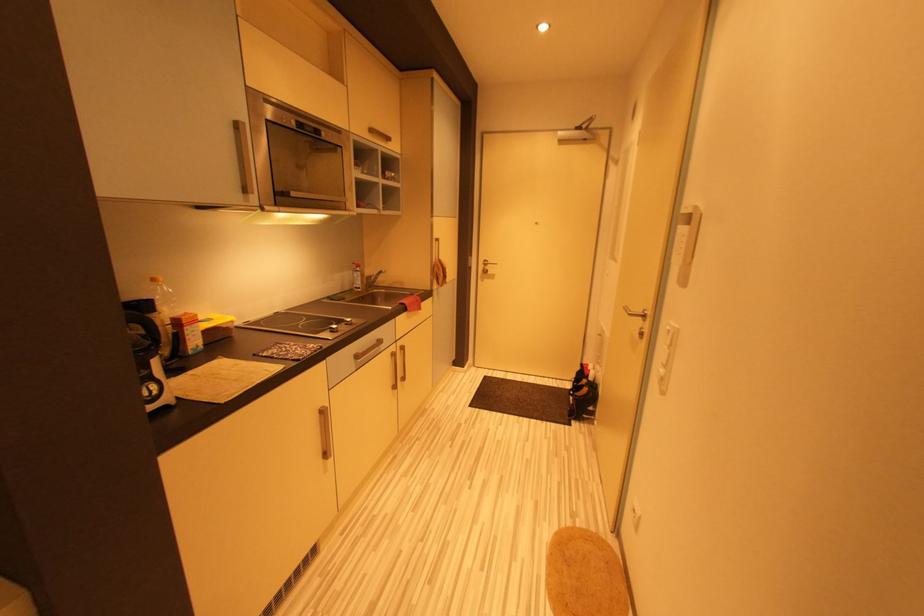
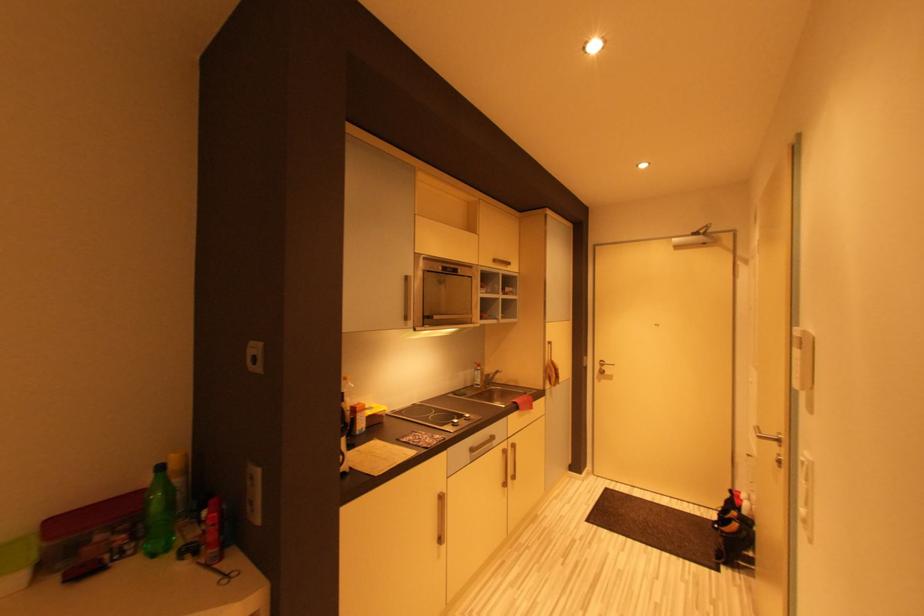
What movement of the cameraman would produce the second image?

The cameraman walked toward right, backward.